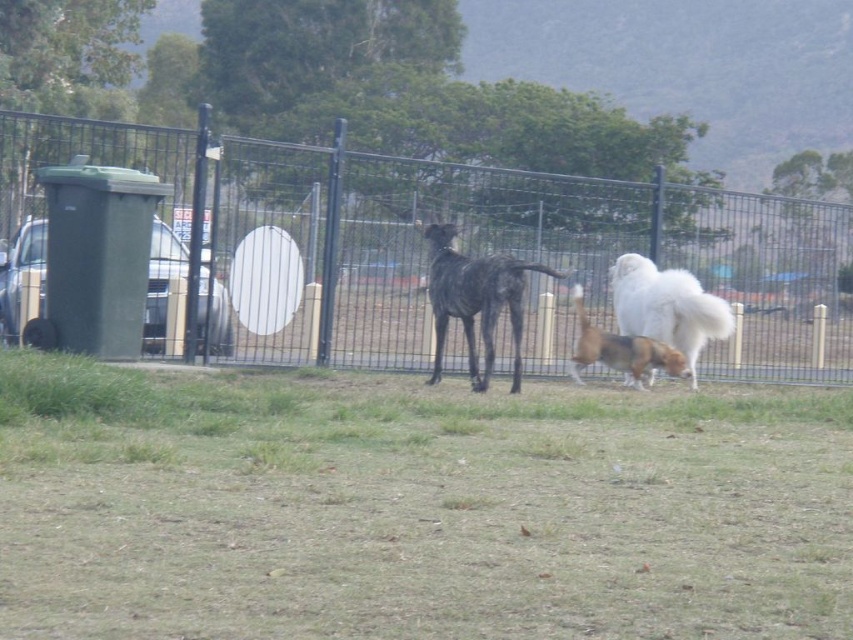
Measure the distance from shiny black dog at center to brown and white fur at center.

shiny black dog at center is 1.45 meters from brown and white fur at center.

Based on the photo, does shiny black dog at center appear on the left side of brown and white fur at center?

Indeed, shiny black dog at center is positioned on the left side of brown and white fur at center.

Who is more forward, [437,348] or [576,346]?

Point [437,348] is more forward.

The image size is (853, 640). I want to click on shiny black dog at center, so click(474, 300).

Which of these two, black metal fence at center or shiny black dog at center, stands taller?

shiny black dog at center

Can you confirm if black metal fence at center is smaller than shiny black dog at center?

Yes, black metal fence at center is smaller than shiny black dog at center.

This screenshot has width=853, height=640. Describe the element at coordinates (457, 250) in the screenshot. I see `black metal fence at center` at that location.

Identify the location of black metal fence at center. (457, 250).

Image resolution: width=853 pixels, height=640 pixels. Describe the element at coordinates (457, 250) in the screenshot. I see `black metal fence at center` at that location.

Which is below, black metal fence at center or brown and white fur at center?

Positioned lower is brown and white fur at center.

Measure the distance between black metal fence at center and camera.

15.15 meters

The width and height of the screenshot is (853, 640). In order to click on black metal fence at center in this screenshot , I will do `click(457, 250)`.